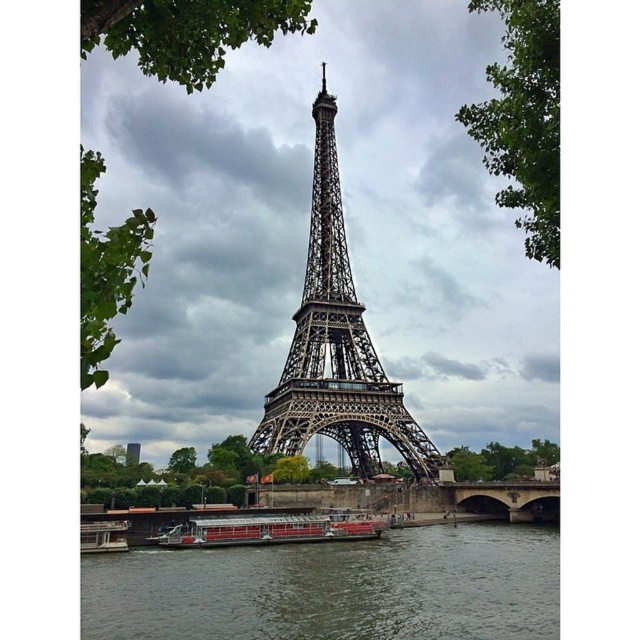
Based on the photo, which of these two, smooth gray water at lower center or metallic structure at center, stands shorter?

With less height is smooth gray water at lower center.

Between smooth gray water at lower center and metallic structure at center, which one appears on the left side from the viewer's perspective?

From the viewer's perspective, smooth gray water at lower center appears more on the left side.

Between point (540, 612) and point (332, 378), which one is positioned in front?

Point (540, 612)

Where is `smooth gray water at lower center`? The height and width of the screenshot is (640, 640). smooth gray water at lower center is located at coordinates (333, 588).

Based on the photo, how far apart are smooth gray water at lower center and metallic red boat at lower left?

20.21 meters

Does smooth gray water at lower center appear over metallic red boat at lower left?

No, smooth gray water at lower center is not above metallic red boat at lower left.

Does point (532, 588) come closer to viewer compared to point (99, 552)?

Yes, it is.

Identify the location of smooth gray water at lower center. (333, 588).

Consider the image. Is metallic eiffel tower at center positioned at the back of metallic structure at center?

Yes, it is.

Which is behind, point (160, 116) or point (316, 157)?

Point (316, 157)

The height and width of the screenshot is (640, 640). I want to click on metallic eiffel tower at center, so click(307, 227).